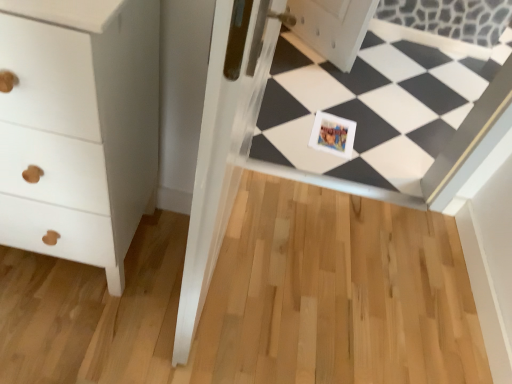
Question: From their relative heights in the image, would you say white glossy frame at center is taller or shorter than white matte chest of drawers at left?

Choices:
 (A) tall
 (B) short

Answer: (B)

Question: Is white glossy frame at center wider or thinner than white matte chest of drawers at left?

Choices:
 (A) wide
 (B) thin

Answer: (B)

Question: Estimate the real-world distances between objects in this image. Which object is farther from the white glossy frame at center?

Choices:
 (A) printed paper postcard at center
 (B) white matte chest of drawers at left

Answer: (B)

Question: Which of these objects is positioned closest to the white glossy frame at center?

Choices:
 (A) printed paper postcard at center
 (B) white matte chest of drawers at left

Answer: (A)